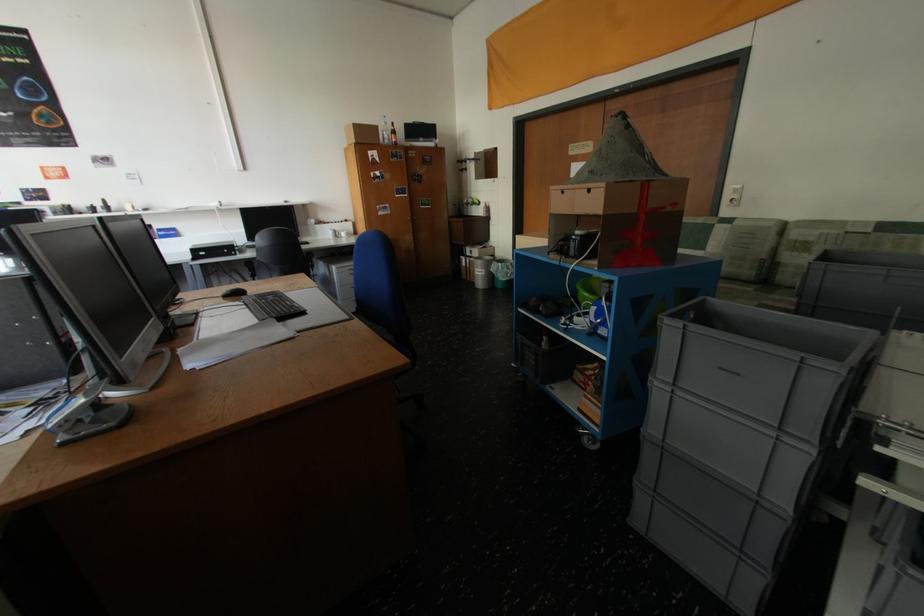
The location [482,270] corresponds to which object?

This point indicates the white trash can.